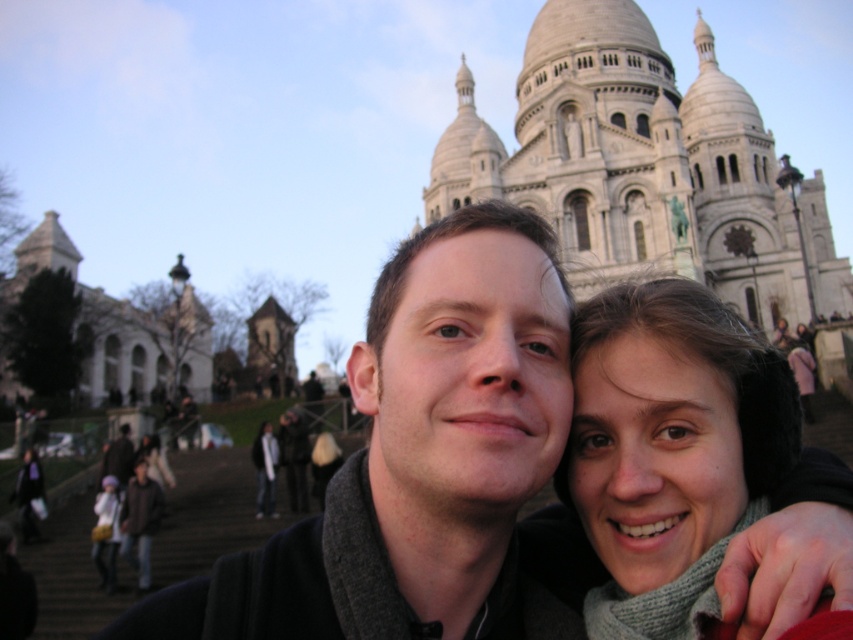
You are a photographer trying to capture a clear shot of both the matte black jacket at center and the matte gray scarf at lower center. Based on their positions, which object should you focus on first to ensure both are in focus?

You should focus on the matte black jacket at center first because it is closer to the viewer than the matte gray scarf at lower center. By focusing on the closer object, the scarf will fall within the depth of field, ensuring both are in focus.

You are a photographer trying to capture a closeup of the gray knitted scarf at center and the matte gray scarf at lower center in the image. Which scarf should you zoom in on to ensure it fills the frame more, considering their sizes?

The gray knitted scarf at center is larger in size than the matte gray scarf at lower center, so you should zoom in on the gray knitted scarf at center to ensure it fills the frame more.

You are taking a selfie in front of the Sacre Coeur Basilica in Paris. You notice a matte black jacket at center and a gray knitted scarf at center. Which item is closer to the camera?

The matte black jacket at center is closer to the camera than the gray knitted scarf at center because it is in front of it.